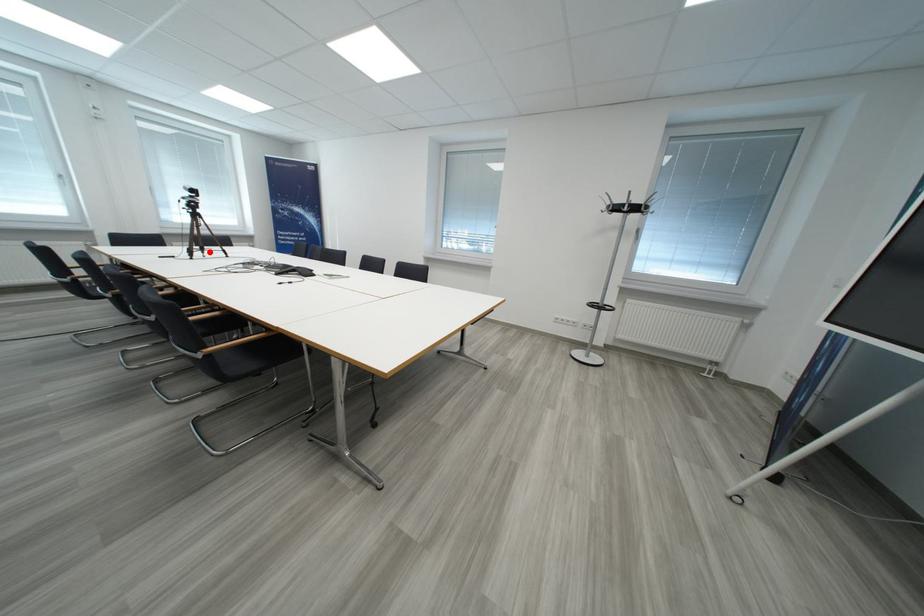
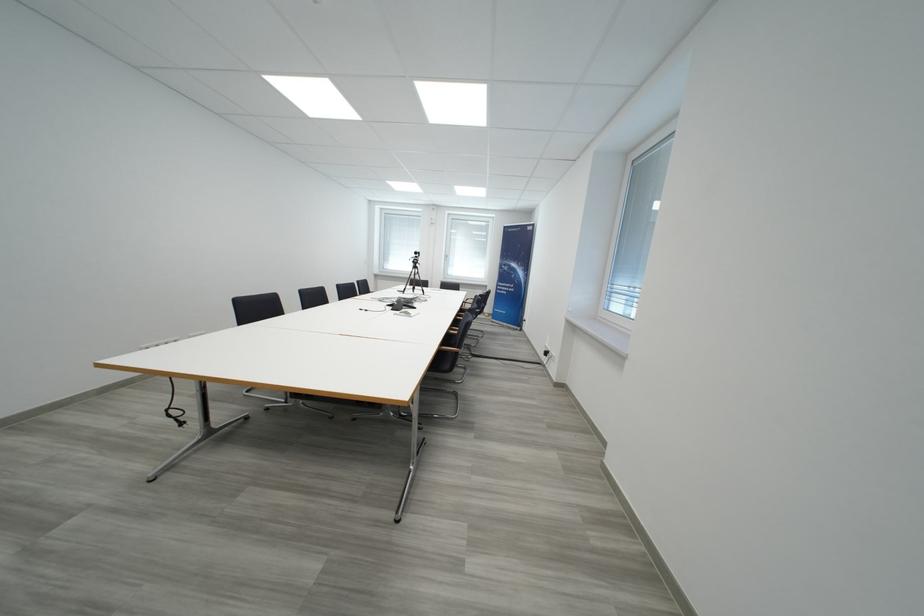
The point at the highlighted location is marked in the first image. Where is the corresponding point in the second image?

(420, 291)